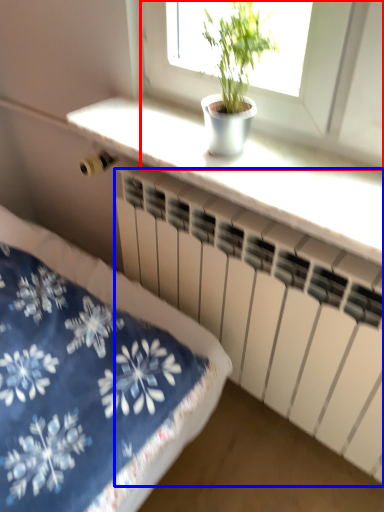
Question: Which point is further to the camera, window (highlighted by a red box) or radiator (highlighted by a blue box)?

Choices:
 (A) window
 (B) radiator

Answer: (B)